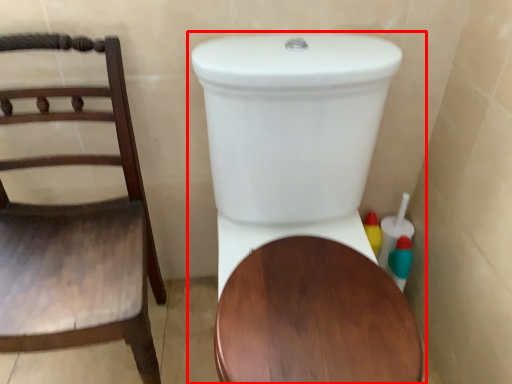
Question: Where is toilet (annotated by the red box) located in relation to chair in the image?

Choices:
 (A) left
 (B) right

Answer: (B)